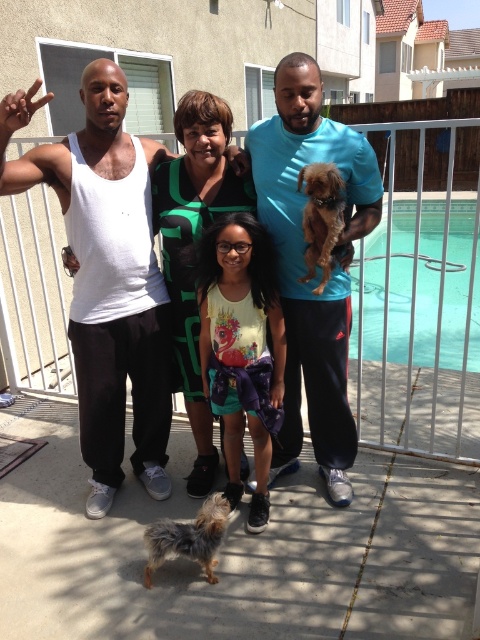
Between blue cotton shirt at center and clear glass pool at right, which one is positioned lower?

blue cotton shirt at center

Identify the location of blue cotton shirt at center. This screenshot has width=480, height=640. (304, 266).

Which is in front, point (287, 256) or point (302, 100)?

Point (302, 100)

Is point (267, 136) farther from viewer compared to point (85, 353)?

No.

The image size is (480, 640). Find the location of `blue cotton shirt at center`. blue cotton shirt at center is located at coordinates (304, 266).

Which is behind, point (108, 422) or point (327, 218)?

The point (108, 422) is behind.

In the scene shown: Does fluffy brown dog at lower left appear on the left side of brown furry dog at center?

Correct, you'll find fluffy brown dog at lower left to the left of brown furry dog at center.

Does point (62, 163) come in front of point (307, 188)?

No, it is not.

The image size is (480, 640). Find the location of `fluffy brown dog at lower left`. fluffy brown dog at lower left is located at coordinates [71, 134].